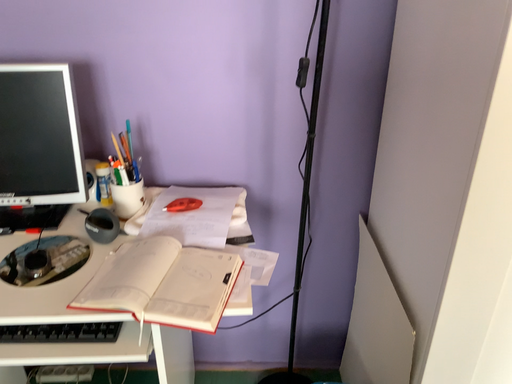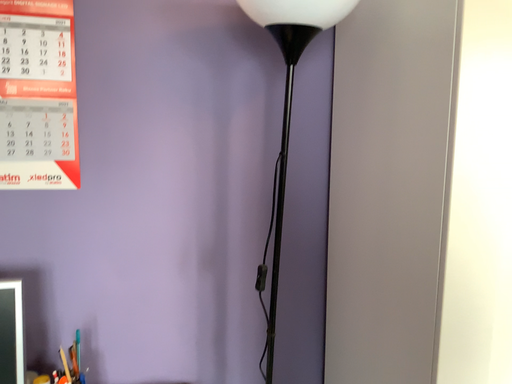
Question: Which way did the camera rotate in the video?

Choices:
 (A) rotated right
 (B) rotated left

Answer: (A)